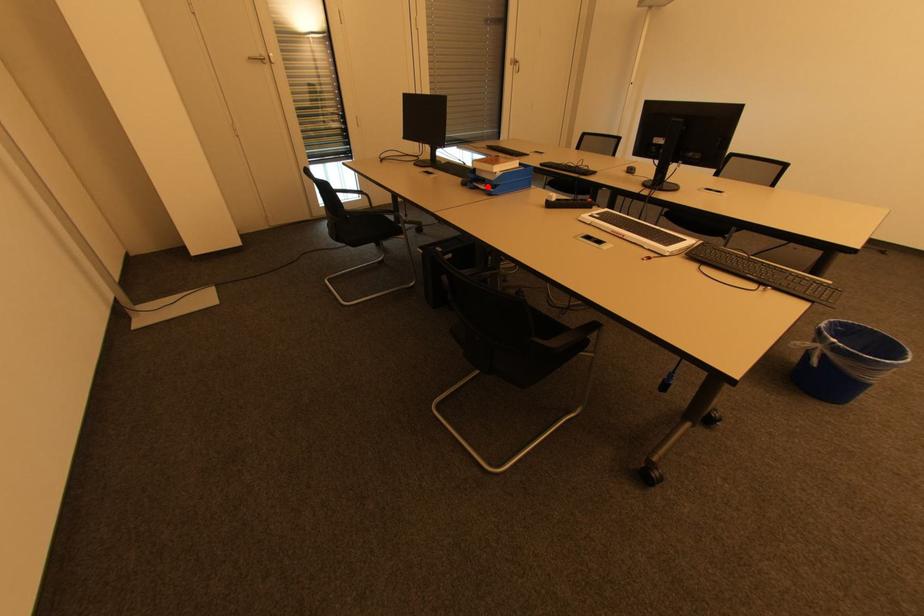
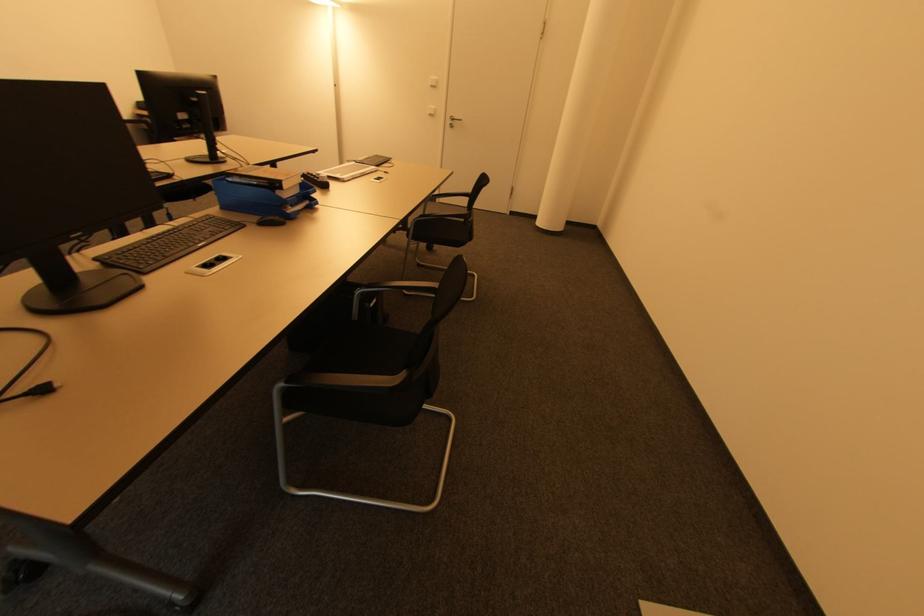
Find the pixel in the second image that matches the highlighted location in the first image.

(294, 207)